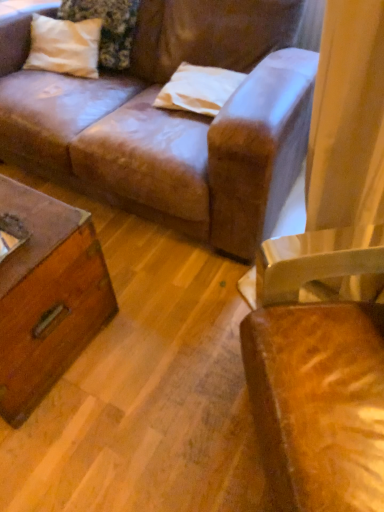
Question: Considering the positions of leather chair at right and white matte pillow at upper center, the 1th pillow in the bottom-to-top sequence, in the image, is leather chair at right wider or thinner than white matte pillow at upper center, the 1th pillow in the bottom-to-top sequence,?

Choices:
 (A) thin
 (B) wide

Answer: (B)

Question: Considering the relative positions of leather chair at right and white matte pillow at upper center, placed as the 2th pillow when sorted from top to bottom, in the image provided, is leather chair at right to the left or to the right of white matte pillow at upper center, placed as the 2th pillow when sorted from top to bottom,?

Choices:
 (A) right
 (B) left

Answer: (A)

Question: Which is nearer to the white cotton pillow at upper left, acting as the first pillow starting from the left?

Choices:
 (A) white matte pillow at upper center, placed as the 2th pillow when sorted from top to bottom
 (B) leather chair at right

Answer: (A)

Question: Which of these objects is positioned closest to the white matte pillow at upper center, the second pillow in the left-to-right sequence?

Choices:
 (A) white cotton pillow at upper left, which is the 2th pillow in bottom-to-top order
 (B) leather chair at right

Answer: (A)